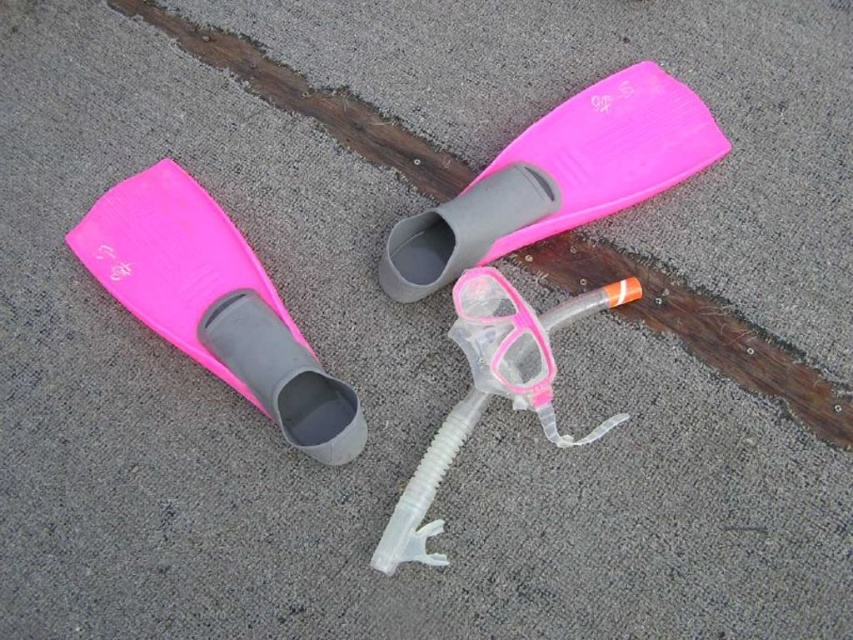
You are a diver preparing to put on your gear. You have the pink matte plastic fins at left and the pink matte flippers at upper center. Which one should you choose if you need the taller equipment for better water propulsion?

The pink matte plastic fins at left is much taller than the pink matte flippers at upper center, so you should choose the pink matte plastic fins at left for better water propulsion.

You are a diver preparing to put on your gear. You have the pink matte flippers at upper center and the pink plastic goggles at center. Which item should you put on first according to their positions?

You should put on the pink plastic goggles at center first because the pink matte flippers at upper center are further away from you, so the goggles are closer and easier to reach.